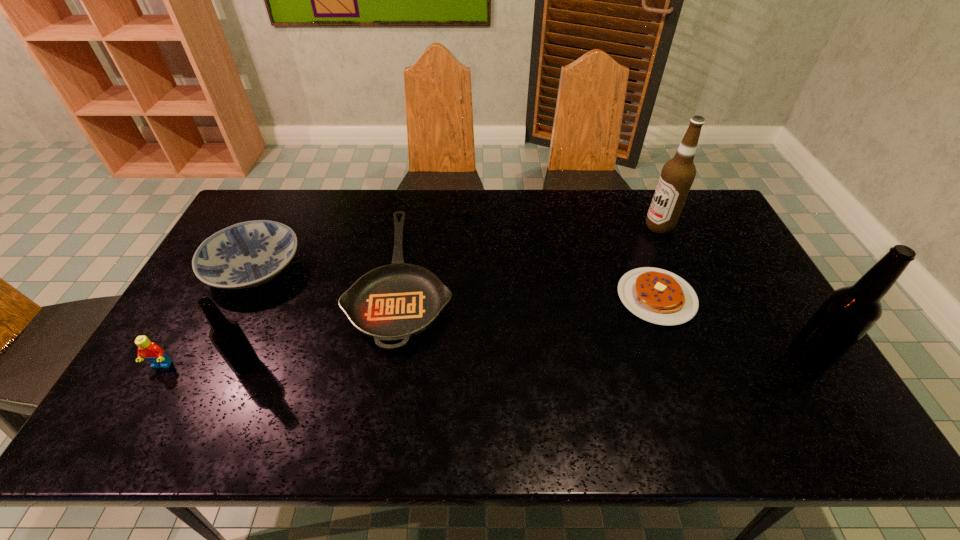
Image resolution: width=960 pixels, height=540 pixels. In order to click on free spot between the pancake and the fourth object from left to right in this screenshot , I will do `click(529, 288)`.

Identify the location of object that ranks as the second closest to the fourth shortest object. The width and height of the screenshot is (960, 540). (248, 254).

Where is `the second closest object to the right beer bottle`? the second closest object to the right beer bottle is located at coordinates (677, 176).

Locate an element on the screen. free region that satisfies the following two spatial constraints: 1. on the back side of the rightmost object; 2. on the label of the alcohol is located at coordinates (728, 226).

Where is `free space that satisfies the following two spatial constraints: 1. on the label of the alcohol; 2. on the left side of the right beer bottle`? The width and height of the screenshot is (960, 540). free space that satisfies the following two spatial constraints: 1. on the label of the alcohol; 2. on the left side of the right beer bottle is located at coordinates (717, 359).

The width and height of the screenshot is (960, 540). Identify the location of free space in the image that satisfies the following two spatial constraints: 1. on the label of the rightmost object; 2. on the left side of the alcohol. (717, 359).

In order to click on blank space that satisfies the following two spatial constraints: 1. on the back side of the taller beer bottle; 2. on the label of the alcohol in this screenshot , I will do `click(728, 226)`.